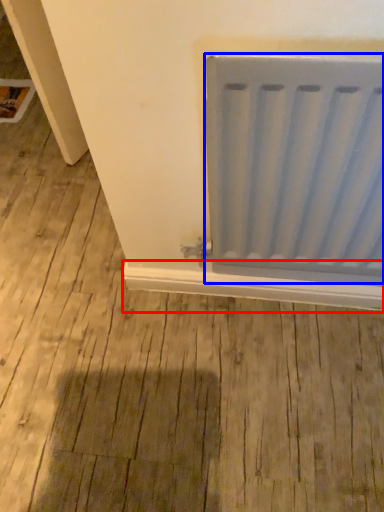
Question: Which object appears closest to the camera in this image, window sill (highlighted by a red box) or radiator (highlighted by a blue box)?

Choices:
 (A) window sill
 (B) radiator

Answer: (B)